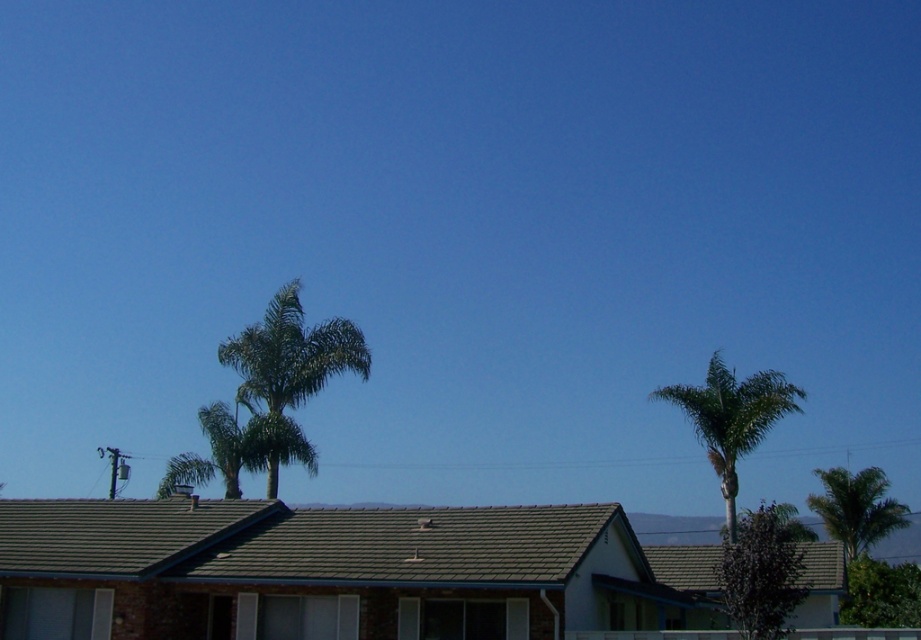
Question: Estimate the real-world distances between objects in this image. Which object is closer to the green leafy tree at center?

Choices:
 (A) green leafy palm tree at upper right
 (B) green leafy palm tree at right
 (C) green leafy palm tree at center

Answer: (A)

Question: Is green leafy palm tree at center further to camera compared to green leafy palm tree at upper right?

Choices:
 (A) no
 (B) yes

Answer: (A)

Question: Estimate the real-world distances between objects in this image. Which object is farther from the green leafy palm tree at center?

Choices:
 (A) green leafy palm tree at right
 (B) green leafy tree at center

Answer: (A)

Question: Does green leafy palm tree at upper right appear under green leafy tree at center?

Choices:
 (A) no
 (B) yes

Answer: (A)

Question: Which of the following is the farthest from the observer?

Choices:
 (A) green leafy tree at center
 (B) green leafy palm tree at upper right
 (C) green leafy palm tree at right

Answer: (C)

Question: Does green leafy palm tree at center lie in front of green leafy tree at center?

Choices:
 (A) yes
 (B) no

Answer: (B)